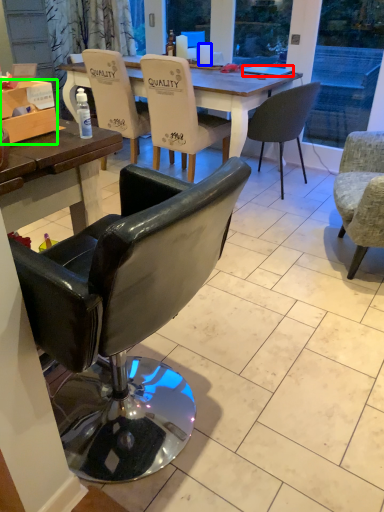
Question: Which object is the farthest from laptop (highlighted by a red box)? Choose among these: coffee cup (highlighted by a blue box) or box (highlighted by a green box).

Choices:
 (A) coffee cup
 (B) box

Answer: (B)